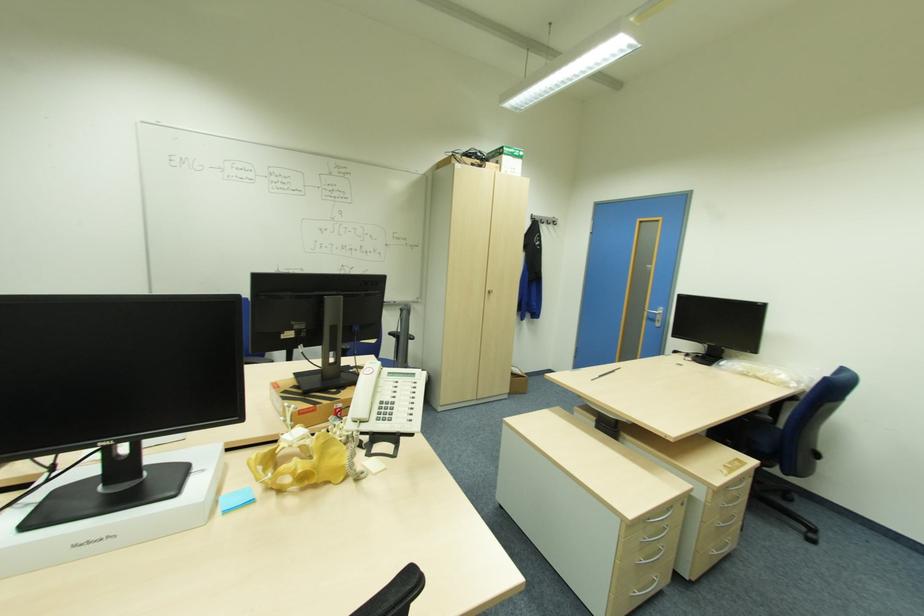
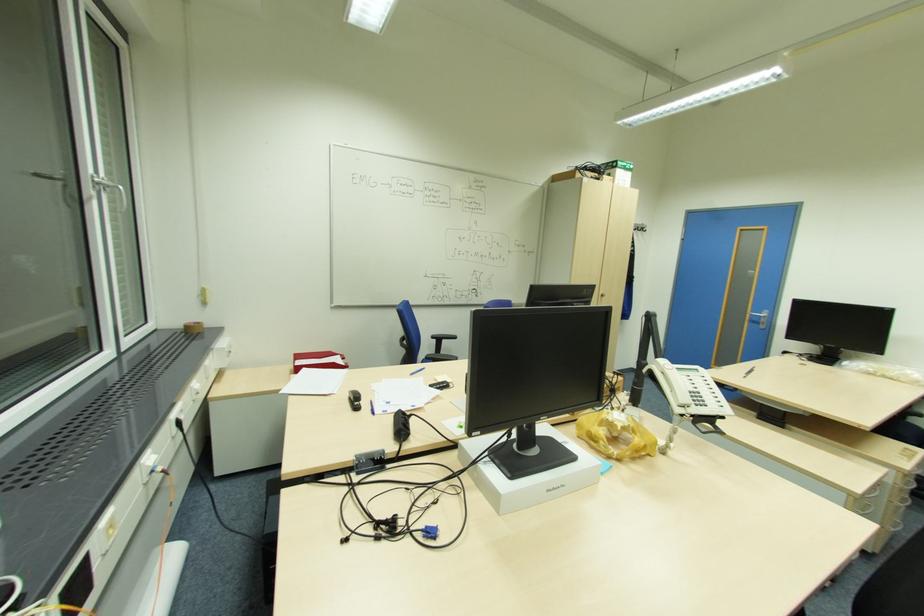
Locate, in the second image, the point that corresponds to the point at 283,490 in the first image.

(621, 459)